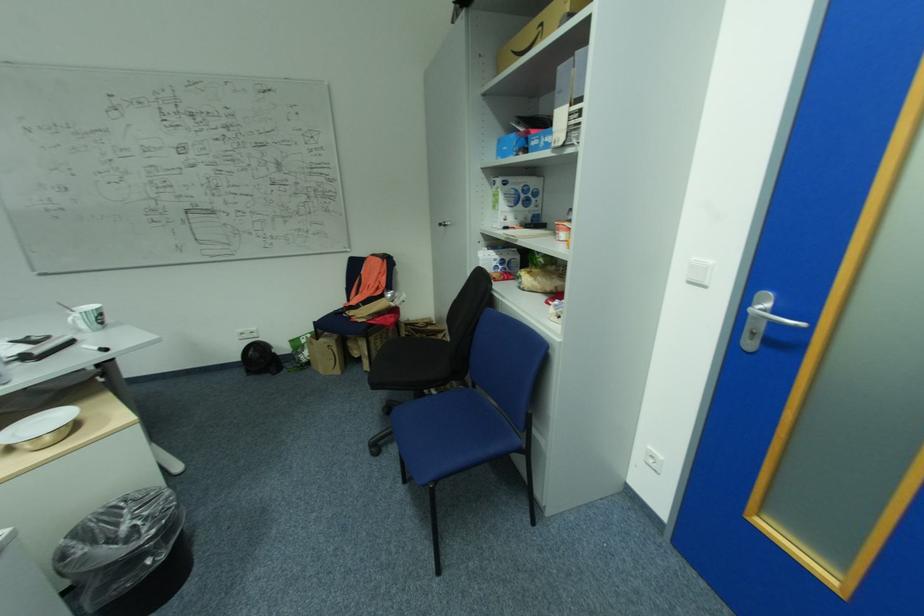
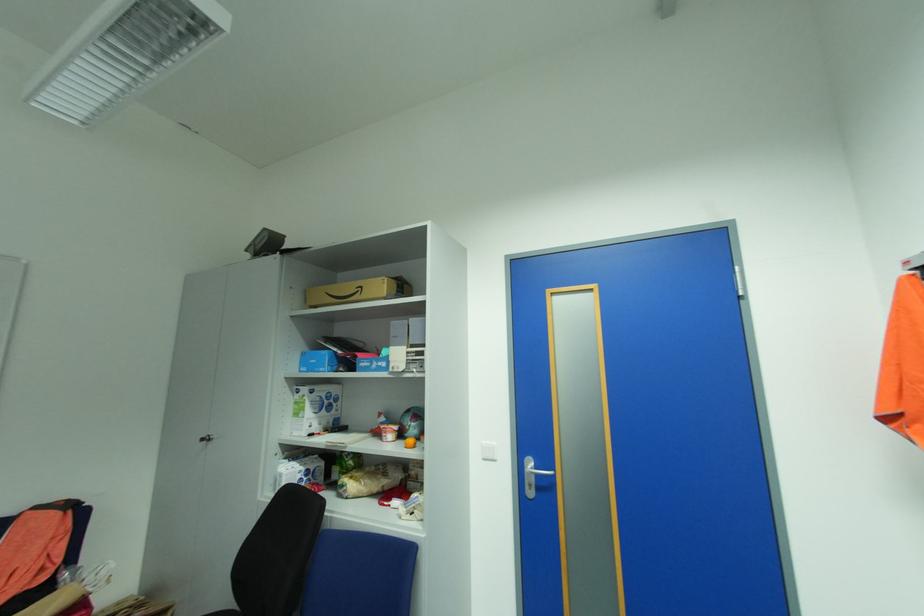
The first image is from the beginning of the video and the second image is from the end. How did the camera likely rotate when shooting the video?

The camera rotated toward right-up.